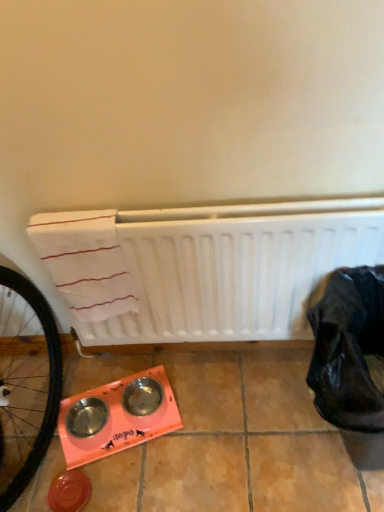
This screenshot has height=512, width=384. I want to click on vacant location below white matte radiator at center (from a real-world perspective), so click(211, 360).